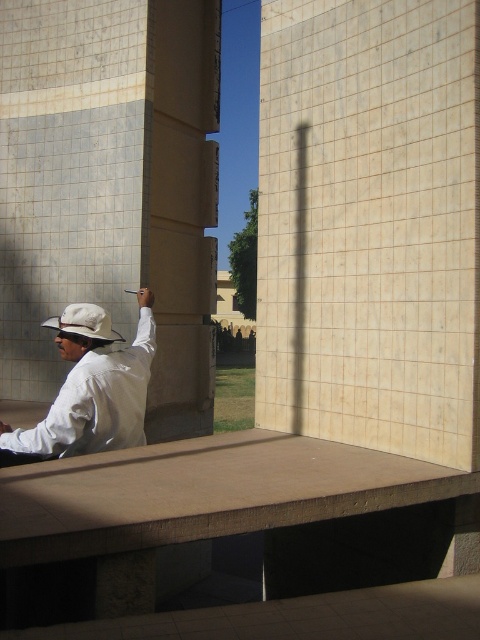
Question: Is smooth concrete ledge at center smaller than white matte shirt at center?

Choices:
 (A) no
 (B) yes

Answer: (A)

Question: Estimate the real-world distances between objects in this image. Which object is closer to the white matte hat at center?

Choices:
 (A) smooth concrete ledge at center
 (B) white matte shirt at center

Answer: (B)

Question: Which of the following is the closest to the observer?

Choices:
 (A) (121, 337)
 (B) (333, 509)
 (C) (118, 419)

Answer: (B)

Question: Is smooth concrete ledge at center positioned before white matte shirt at center?

Choices:
 (A) no
 (B) yes

Answer: (B)

Question: Does smooth concrete ledge at center lie in front of white matte shirt at center?

Choices:
 (A) no
 (B) yes

Answer: (B)

Question: Estimate the real-world distances between objects in this image. Which object is closer to the white matte shirt at center?

Choices:
 (A) white matte hat at center
 (B) smooth concrete ledge at center

Answer: (A)